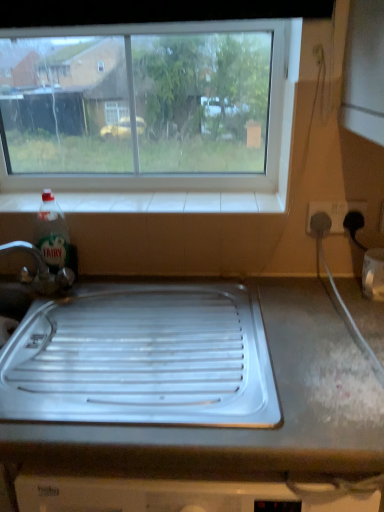
This screenshot has height=512, width=384. Find the location of `vacant area on top of metallic gray tray at center (from a real-world perspective)`. vacant area on top of metallic gray tray at center (from a real-world perspective) is located at coordinates (239, 374).